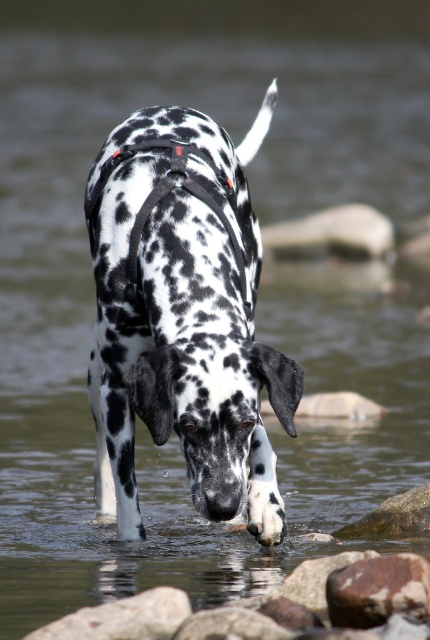
Question: Does spotted fur at center have a greater width compared to smooth brown rock at lower center?

Choices:
 (A) no
 (B) yes

Answer: (A)

Question: Which of the following is the closest to the observer?

Choices:
 (A) rustic brown rock at lower right
 (B) smooth brown rock at lower center
 (C) rocky stone at lower center
 (D) spotted fur at center

Answer: (D)

Question: Which point is closer to the camera taking this photo?

Choices:
 (A) (353, 605)
 (B) (285, 417)

Answer: (B)

Question: Does smooth brown rock at lower center have a greater width compared to rustic brown rock at lower right?

Choices:
 (A) no
 (B) yes

Answer: (B)

Question: Considering the real-world distances, which object is farthest from the spotted fur at center?

Choices:
 (A) smooth brown rock at lower center
 (B) rocky stone at lower center

Answer: (B)

Question: Does smooth brown rock at lower center appear on the right side of rocky stone at lower center?

Choices:
 (A) yes
 (B) no

Answer: (A)